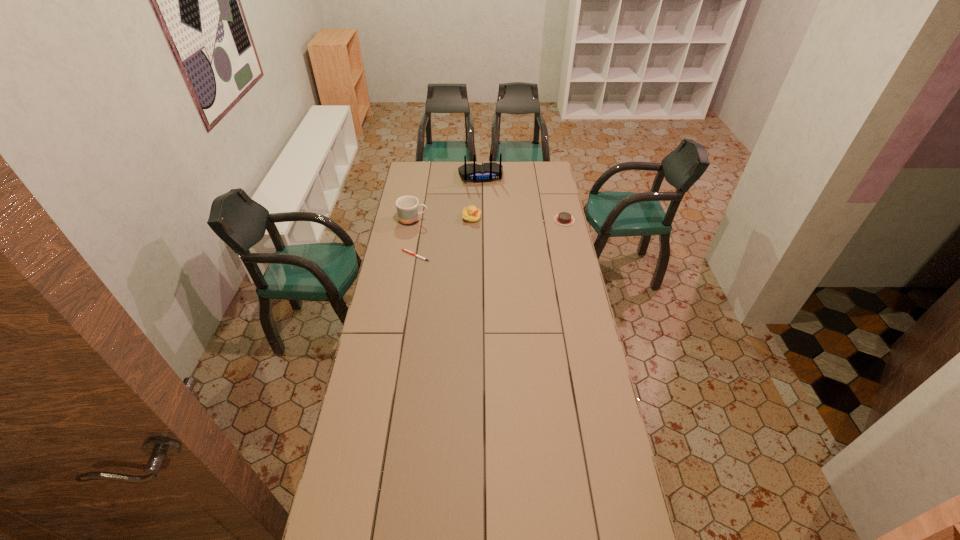
This screenshot has width=960, height=540. I want to click on free space that satisfies the following two spatial constraints: 1. on the back side of the duckling; 2. on the left side of the farthest object, so click(472, 176).

What are the coordinates of `vacant region that satisfies the following two spatial constraints: 1. on the back side of the third shortest object; 2. on the right side of the tallest object` in the screenshot? It's located at (472, 176).

I want to click on blank area in the image that satisfies the following two spatial constraints: 1. on the front side of the duckling; 2. on the left side of the fourth tallest object, so click(x=471, y=220).